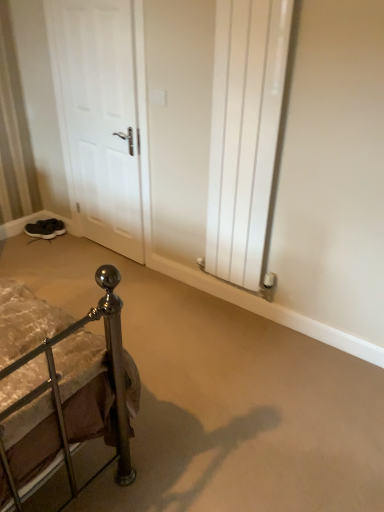
Locate an element on the screen. The height and width of the screenshot is (512, 384). unoccupied region to the right of dark gray suede sneakers at lower left, which appears as the 2th footwear when viewed from the back is located at coordinates (70, 237).